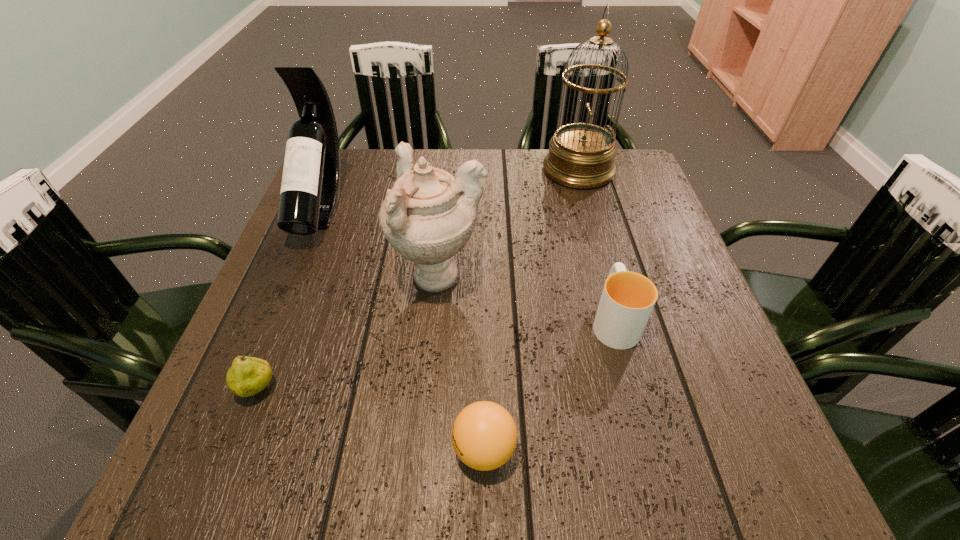
Identify the location of birdcage. The image size is (960, 540). (581, 155).

The width and height of the screenshot is (960, 540). I want to click on wine bottle, so click(310, 187).

Where is `urn`? The height and width of the screenshot is (540, 960). urn is located at coordinates (428, 216).

Identify the location of cup. (627, 300).

The image size is (960, 540). What are the coordinates of `pear` in the screenshot? It's located at (247, 376).

Find the location of `the nearest object`. the nearest object is located at coordinates (484, 435).

I want to click on free spot located 0.350m with an open door on the tallest object, so click(418, 170).

Identify the location of vacant area situated 0.200m with an open door on the tallest object. (471, 170).

Where is `free space located 0.100m with an open door on the tallest object`? This screenshot has height=540, width=960. free space located 0.100m with an open door on the tallest object is located at coordinates (507, 170).

The height and width of the screenshot is (540, 960). What are the coordinates of `vacant space located 0.250m on the stand of the wine bottle` in the screenshot? It's located at (264, 346).